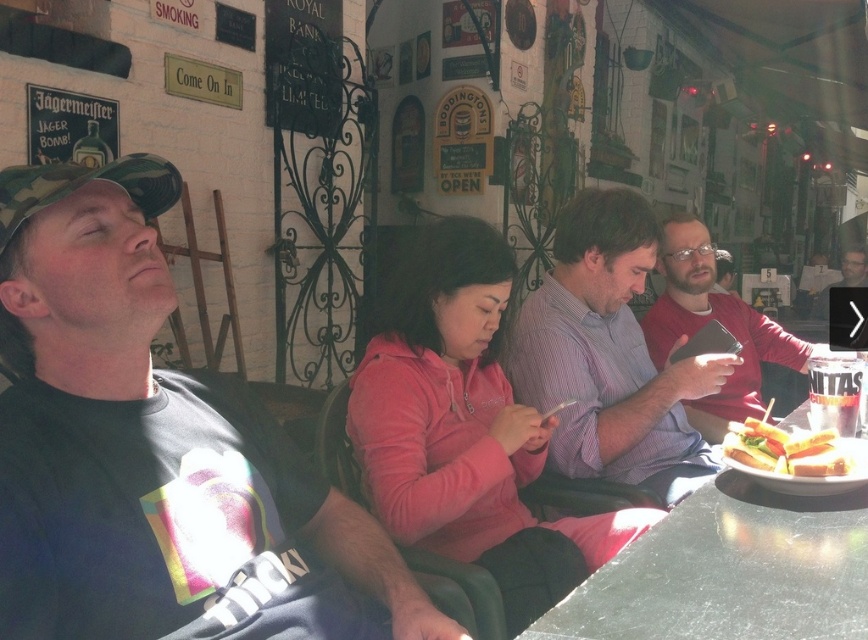
You are standing in the pub and want to place a small plant between the two points marked as point (768, 500) and point (845, 451). Which point should the plant be closer to in order to be nearer to the viewer?

The plant should be placed closer to point (768, 500) because it is nearer to the viewer compared to point (845, 451).